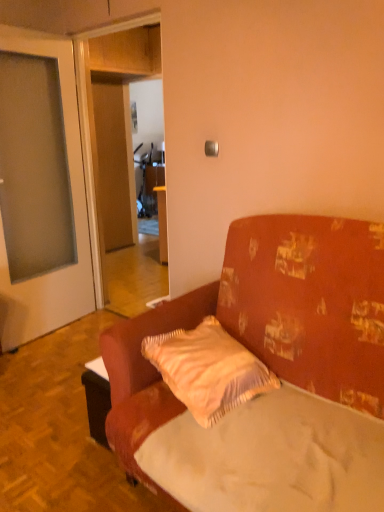
Question: From a real-world perspective, is white fabric mattress at center positioned under light beige textured pillow at center based on gravity?

Choices:
 (A) yes
 (B) no

Answer: (A)

Question: Is white fabric mattress at center next to light beige textured pillow at center and touching it?

Choices:
 (A) no
 (B) yes

Answer: (A)

Question: Can you confirm if white fabric mattress at center is taller than light beige textured pillow at center?

Choices:
 (A) yes
 (B) no

Answer: (B)

Question: Is white fabric mattress at center further to camera compared to light beige textured pillow at center?

Choices:
 (A) no
 (B) yes

Answer: (A)

Question: Can you confirm if white fabric mattress at center is bigger than light beige textured pillow at center?

Choices:
 (A) yes
 (B) no

Answer: (A)

Question: Is white fabric mattress at center positioned beyond the bounds of light beige textured pillow at center?

Choices:
 (A) yes
 (B) no

Answer: (A)

Question: Does textured fabric couch at center have a lesser height compared to white fabric mattress at center?

Choices:
 (A) yes
 (B) no

Answer: (B)

Question: Is textured fabric couch at center not within white fabric mattress at center?

Choices:
 (A) no
 (B) yes

Answer: (B)

Question: Does textured fabric couch at center have a larger size compared to white fabric mattress at center?

Choices:
 (A) no
 (B) yes

Answer: (B)

Question: Considering the relative sizes of textured fabric couch at center and white fabric mattress at center in the image provided, is textured fabric couch at center wider than white fabric mattress at center?

Choices:
 (A) no
 (B) yes

Answer: (B)

Question: Is the surface of textured fabric couch at center in direct contact with white fabric mattress at center?

Choices:
 (A) no
 (B) yes

Answer: (A)

Question: Considering the relative sizes of textured fabric couch at center and white fabric mattress at center in the image provided, is textured fabric couch at center thinner than white fabric mattress at center?

Choices:
 (A) yes
 (B) no

Answer: (B)

Question: Does light beige textured pillow at center come behind white fabric mattress at center?

Choices:
 (A) no
 (B) yes

Answer: (B)